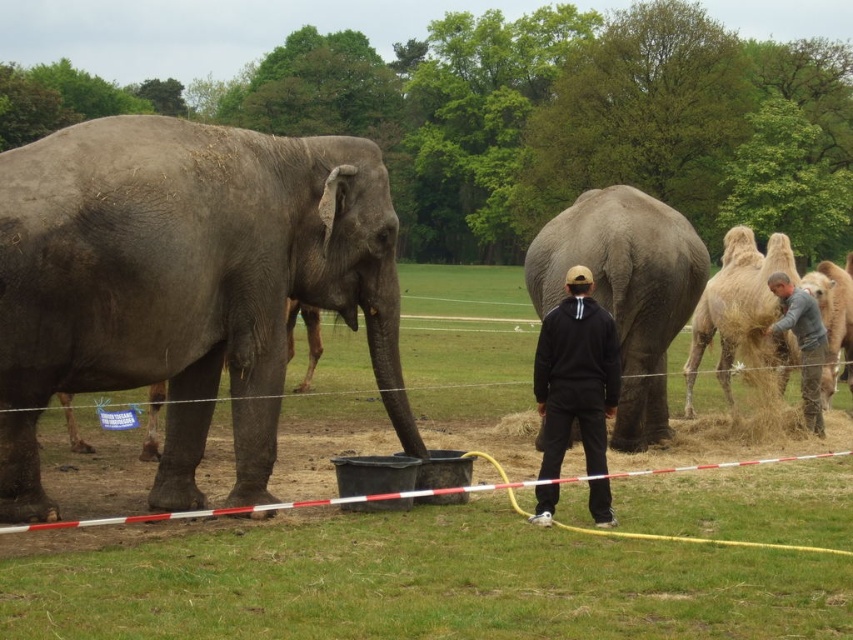
Can you confirm if gray matte elephant at center is smaller than black hoodie at center?

Incorrect, gray matte elephant at center is not smaller in size than black hoodie at center.

Is gray matte elephant at center bigger than black hoodie at center?

Result: Correct, gray matte elephant at center is larger in size than black hoodie at center.

Between point (671, 244) and point (548, 468), which one is positioned behind?

The point (671, 244) is behind.

This screenshot has height=640, width=853. Find the location of `gray matte elephant at center`. gray matte elephant at center is located at coordinates (625, 291).

Is point (200, 452) behind point (581, 374)?

Yes, it is behind point (581, 374).

Is gray matte elephant at left to the right of black hoodie at center from the viewer's perspective?

No, gray matte elephant at left is not to the right of black hoodie at center.

Who is more distant from viewer, (177, 374) or (543, 448)?

Point (543, 448)

Where is `gray matte elephant at left`? Image resolution: width=853 pixels, height=640 pixels. gray matte elephant at left is located at coordinates (184, 284).

Can you confirm if gray matte elephant at left is positioned below light brown textured camel at right?

No.

In the scene shown: Is gray matte elephant at left positioned in front of light brown textured camel at right?

That is True.

Find the location of a particular element. The height and width of the screenshot is (640, 853). gray matte elephant at left is located at coordinates (184, 284).